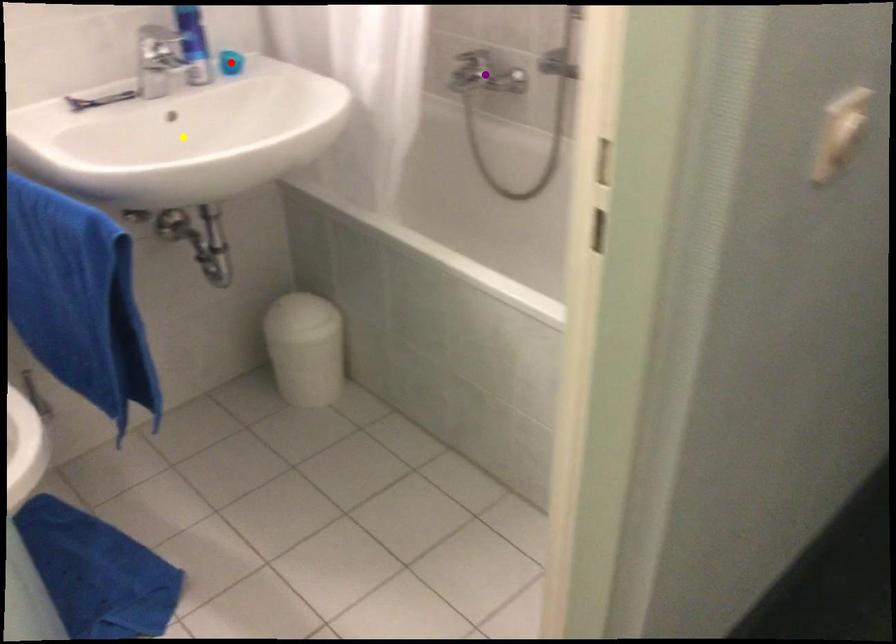
Order these from nearest to farthest:
1. red point
2. purple point
3. yellow point

purple point → red point → yellow point